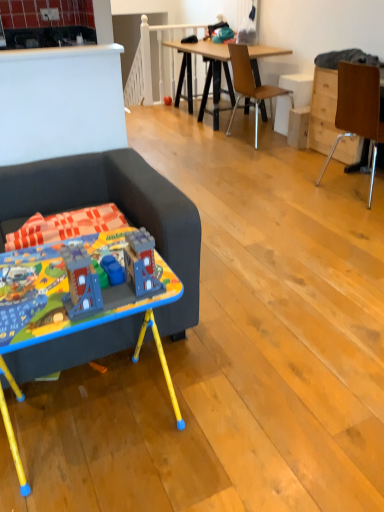
Question: Is wooden drawer at right at the left side of dark gray fabric couch at left?

Choices:
 (A) no
 (B) yes

Answer: (A)

Question: Considering the relative sizes of wooden drawer at right and dark gray fabric couch at left in the image provided, is wooden drawer at right smaller than dark gray fabric couch at left?

Choices:
 (A) no
 (B) yes

Answer: (B)

Question: Is wooden drawer at right positioned behind dark gray fabric couch at left?

Choices:
 (A) no
 (B) yes

Answer: (B)

Question: From a real-world perspective, is wooden drawer at right on dark gray fabric couch at left?

Choices:
 (A) no
 (B) yes

Answer: (A)

Question: Does wooden drawer at right appear on the right side of dark gray fabric couch at left?

Choices:
 (A) yes
 (B) no

Answer: (A)

Question: Considering the positions of blue plastic desk at lower left and matte plastic toy at center, which is the 1th toy in top-to-bottom order, in the image, is blue plastic desk at lower left bigger or smaller than matte plastic toy at center, which is the 1th toy in top-to-bottom order,?

Choices:
 (A) big
 (B) small

Answer: (A)

Question: Considering the positions of point (150, 304) and point (168, 96), is point (150, 304) closer or farther from the camera than point (168, 96)?

Choices:
 (A) farther
 (B) closer

Answer: (B)

Question: From the image's perspective, is blue plastic desk at lower left located above or below matte plastic toy at center, which appears as the 1th toy when viewed from the back?

Choices:
 (A) below
 (B) above

Answer: (A)

Question: From a real-world perspective, is blue plastic desk at lower left physically located above or below matte plastic toy at center, which appears as the second toy when viewed from the front?

Choices:
 (A) above
 (B) below

Answer: (A)

Question: From a real-world perspective, is dark gray fabric couch at left above or below wooden chair at right, the 1th chair when ordered from right to left?

Choices:
 (A) above
 (B) below

Answer: (B)

Question: In terms of size, does dark gray fabric couch at left appear bigger or smaller than wooden chair at right, the second chair positioned from the back?

Choices:
 (A) big
 (B) small

Answer: (A)

Question: In terms of height, does dark gray fabric couch at left look taller or shorter compared to wooden chair at right, acting as the 1th chair starting from the front?

Choices:
 (A) short
 (B) tall

Answer: (A)

Question: Looking at their shapes, would you say dark gray fabric couch at left is wider or thinner than wooden chair at right, acting as the 1th chair starting from the front?

Choices:
 (A) wide
 (B) thin

Answer: (A)

Question: Considering the relative positions of matte plastic toy at center, which appears as the second toy when viewed from the front, and wooden chair at right, the second chair positioned from the back, in the image provided, is matte plastic toy at center, which appears as the second toy when viewed from the front, to the left or to the right of wooden chair at right, the second chair positioned from the back,?

Choices:
 (A) left
 (B) right

Answer: (A)

Question: Considering the positions of matte plastic toy at center, which is the 1th toy in top-to-bottom order, and wooden chair at right, which is counted as the second chair, starting from the left, in the image, is matte plastic toy at center, which is the 1th toy in top-to-bottom order, taller or shorter than wooden chair at right, which is counted as the second chair, starting from the left,?

Choices:
 (A) short
 (B) tall

Answer: (A)